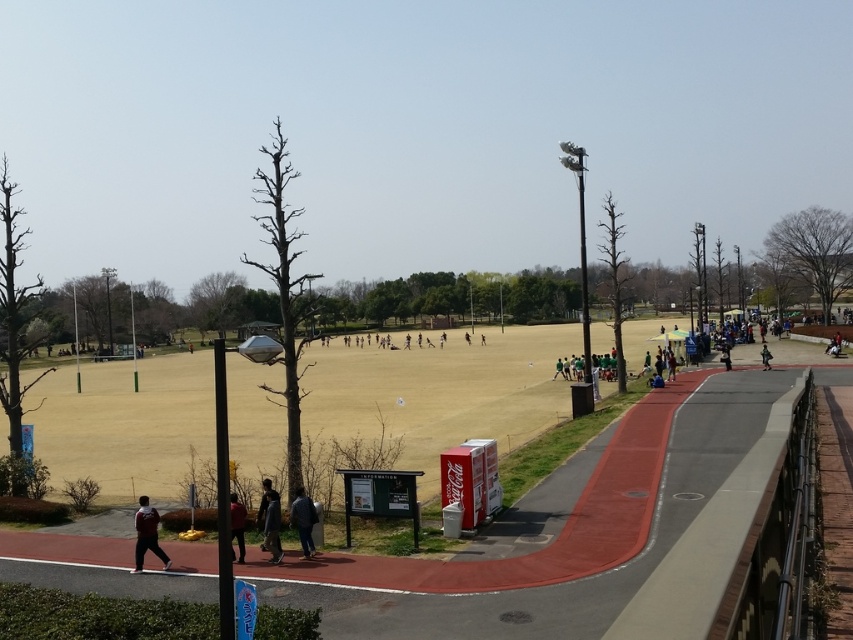
Question: Considering the real-world distances, which object is closest to the grass soccer field at center?

Choices:
 (A) dark gray jacket at center
 (B) dark blue fabric jacket at lower center
 (C) dark gray fabric jacket at lower center

Answer: (A)

Question: Among these objects, which one is nearest to the camera?

Choices:
 (A) dark red jacket at lower left
 (B) dark red fabric jacket at lower left
 (C) grass soccer field at center
 (D) dark gray fabric jacket at lower center

Answer: (B)

Question: Does dark red jacket at lower left appear over dark gray fabric jacket at lower center?

Choices:
 (A) no
 (B) yes

Answer: (A)

Question: Which point appears closest to the camera in this image?

Choices:
 (A) (260, 506)
 (B) (88, 472)
 (C) (276, 509)

Answer: (C)

Question: Does grass soccer field at center appear on the left side of dark red fabric jacket at lower left?

Choices:
 (A) no
 (B) yes

Answer: (B)

Question: Does dark red jacket at lower left come behind dark gray fabric jacket at lower center?

Choices:
 (A) yes
 (B) no

Answer: (B)